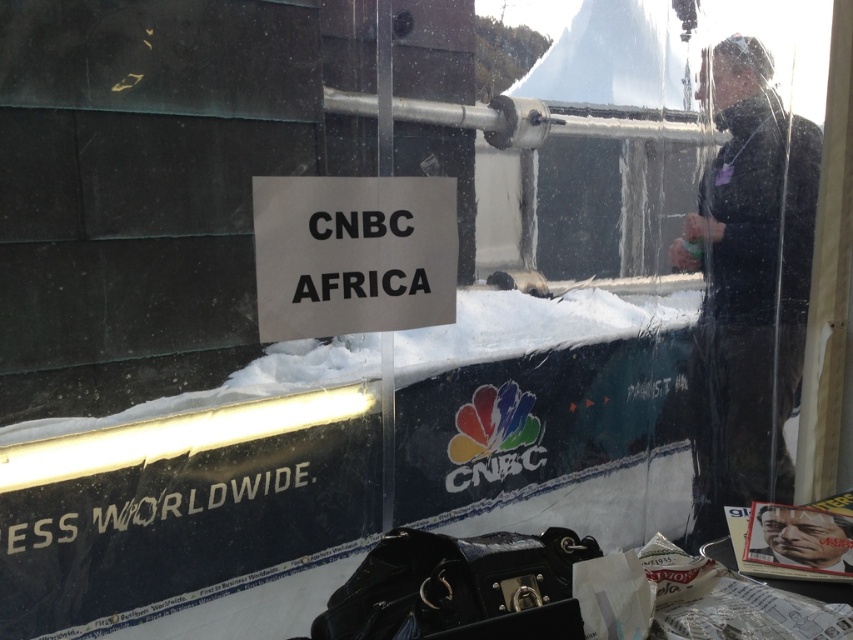
Question: From the image, what is the correct spatial relationship of transparent plastic at upper right in relation to black paper sign at center?

Choices:
 (A) right
 (B) left

Answer: (A)

Question: Which is farther from the transparent plastic at upper right?

Choices:
 (A) black paper sign at center
 (B) smooth plastic face at lower right

Answer: (B)

Question: Is transparent plastic at upper right below black matte jacket at right?

Choices:
 (A) yes
 (B) no

Answer: (B)

Question: Among these objects, which one is nearest to the camera?

Choices:
 (A) black matte jacket at right
 (B) transparent plastic at upper right

Answer: (B)

Question: Which point is closer to the camera?

Choices:
 (A) (788, 556)
 (B) (544, 273)

Answer: (A)

Question: Is transparent plastic at upper right to the left of black paper sign at center from the viewer's perspective?

Choices:
 (A) no
 (B) yes

Answer: (A)